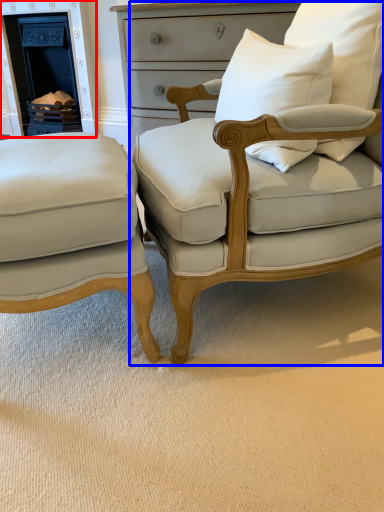
Question: Which object appears farthest to the camera in this image, fireplace (highlighted by a red box) or chair (highlighted by a blue box)?

Choices:
 (A) fireplace
 (B) chair

Answer: (A)